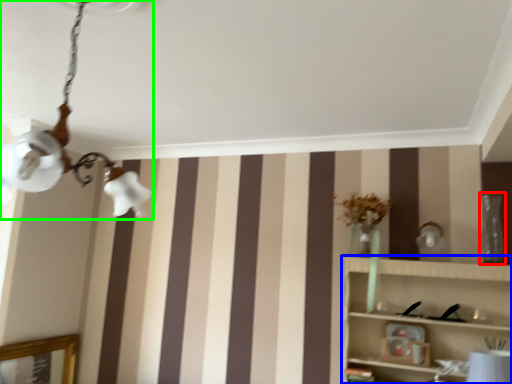
Question: Which object is positioned farthest from glass vase (highlighted by a red box)? Select from shelf (highlighted by a blue box) and lamp (highlighted by a green box).

Choices:
 (A) shelf
 (B) lamp

Answer: (B)